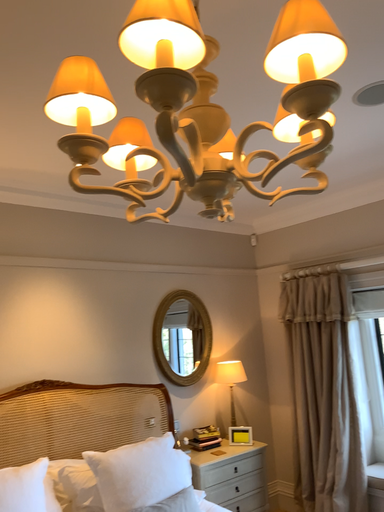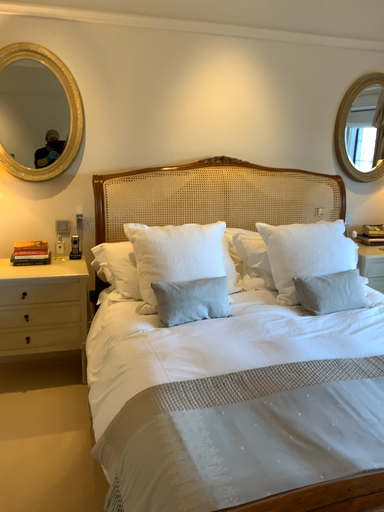
Question: How did the camera likely rotate when shooting the video?

Choices:
 (A) rotated upward
 (B) rotated downward

Answer: (B)